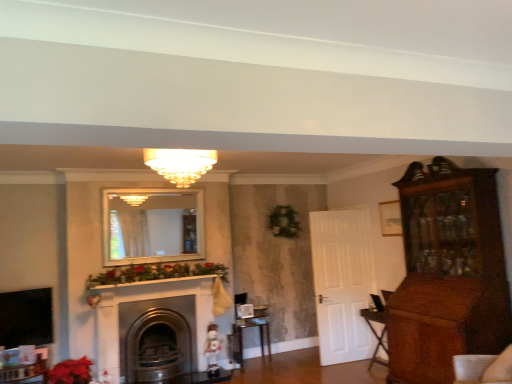
Question: Is point (174, 152) closer or farther from the camera than point (77, 370)?

Choices:
 (A) closer
 (B) farther

Answer: (A)

Question: From their relative heights in the image, would you say matte glass chandelier at center is taller or shorter than vivid red petals at lower left?

Choices:
 (A) short
 (B) tall

Answer: (A)

Question: Which is nearer to the metallic gold fireplace at center?

Choices:
 (A) metallic silver table at center
 (B) vivid red petals at lower left
 (C) matte glass chandelier at center

Answer: (B)

Question: Which object is positioned closest to the matte glass chandelier at center?

Choices:
 (A) metallic silver table at center
 (B) metallic gold fireplace at center
 (C) vivid red petals at lower left

Answer: (B)